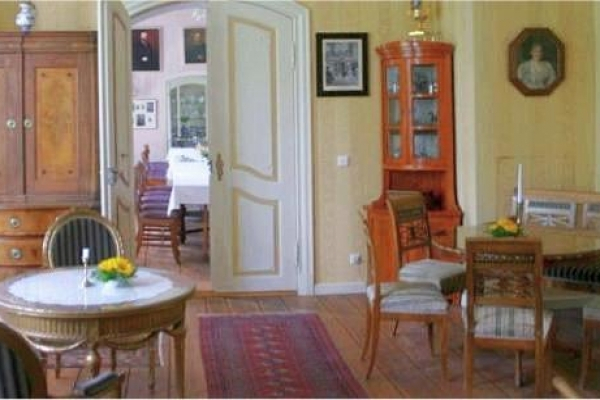
Locate an element on the screen. This screenshot has width=600, height=400. cushion is located at coordinates (419, 303), (431, 271).